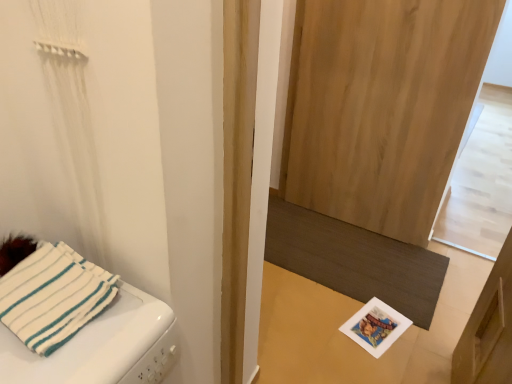
Question: From the image's perspective, would you say dark brown textured mat at lower center is positioned over natural wood screen door at center?

Choices:
 (A) no
 (B) yes

Answer: (A)

Question: Is the depth of dark brown textured mat at lower center greater than that of natural wood screen door at center?

Choices:
 (A) no
 (B) yes

Answer: (B)

Question: Can you confirm if dark brown textured mat at lower center is positioned to the right of natural wood screen door at center?

Choices:
 (A) yes
 (B) no

Answer: (B)

Question: Is dark brown textured mat at lower center not close to natural wood screen door at center?

Choices:
 (A) yes
 (B) no

Answer: (B)

Question: From a real-world perspective, is dark brown textured mat at lower center located higher than natural wood screen door at center?

Choices:
 (A) no
 (B) yes

Answer: (A)

Question: From the image's perspective, relative to natural wood screen door at center, is dark brown textured mat at lower center above or below?

Choices:
 (A) above
 (B) below

Answer: (B)

Question: Does point (371, 269) appear closer or farther from the camera than point (389, 62)?

Choices:
 (A) farther
 (B) closer

Answer: (A)

Question: From a real-world perspective, is dark brown textured mat at lower center physically located above or below natural wood screen door at center?

Choices:
 (A) below
 (B) above

Answer: (A)

Question: Is dark brown textured mat at lower center in front of or behind natural wood screen door at center in the image?

Choices:
 (A) front
 (B) behind

Answer: (B)

Question: In terms of width, does dark brown textured mat at lower center look wider or thinner when compared to white fabric towel at left?

Choices:
 (A) wide
 (B) thin

Answer: (A)

Question: Is dark brown textured mat at lower center inside the boundaries of white fabric towel at left, or outside?

Choices:
 (A) outside
 (B) inside

Answer: (A)

Question: Considering the positions of point (328, 264) and point (97, 329), is point (328, 264) closer or farther from the camera than point (97, 329)?

Choices:
 (A) closer
 (B) farther

Answer: (B)

Question: From their relative heights in the image, would you say dark brown textured mat at lower center is taller or shorter than white fabric towel at left?

Choices:
 (A) tall
 (B) short

Answer: (B)

Question: Is white fabric towel at left inside or outside of natural wood screen door at center?

Choices:
 (A) outside
 (B) inside

Answer: (A)

Question: Looking at their shapes, would you say white fabric towel at left is wider or thinner than natural wood screen door at center?

Choices:
 (A) wide
 (B) thin

Answer: (A)